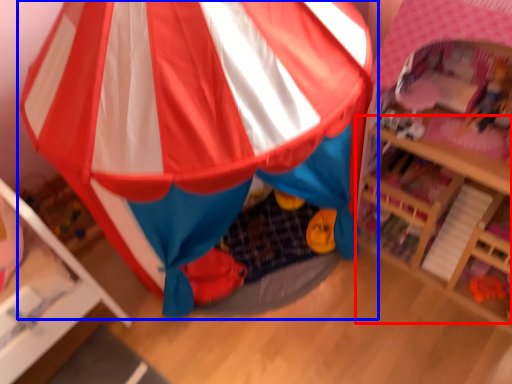
Question: Which of the following is the farthest to the observer, table (highlighted by a red box) or tent (highlighted by a blue box)?

Choices:
 (A) table
 (B) tent

Answer: (A)